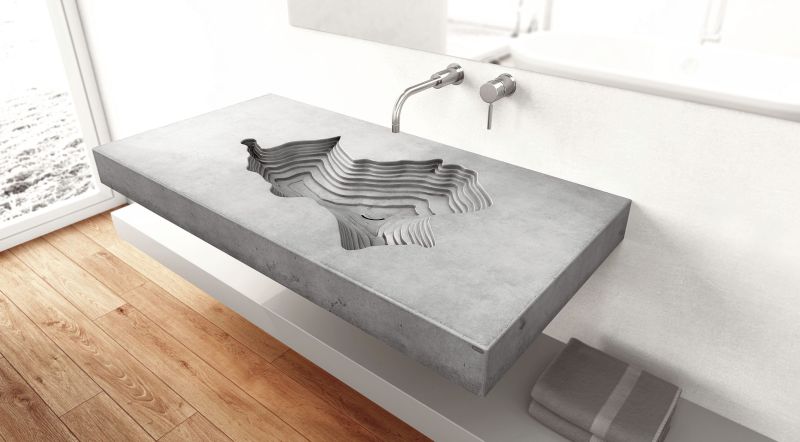
Locate an element on the screen. This screenshot has height=442, width=800. mirror is located at coordinates (637, 60).